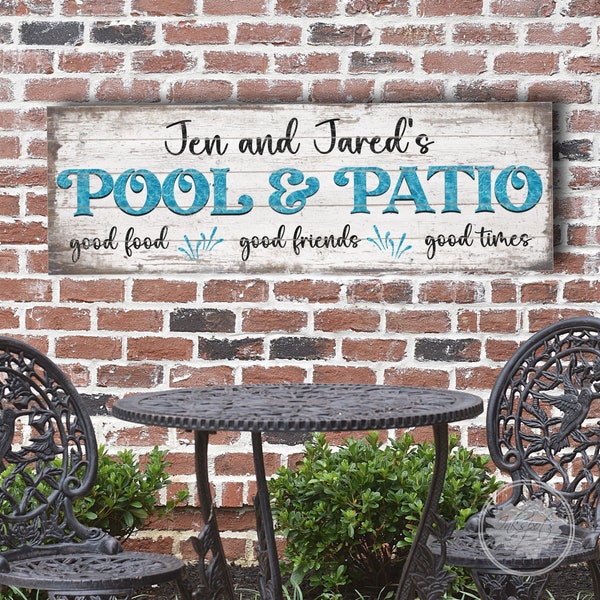
This screenshot has width=600, height=600. Find the location of `table leg`. table leg is located at coordinates (442, 450).